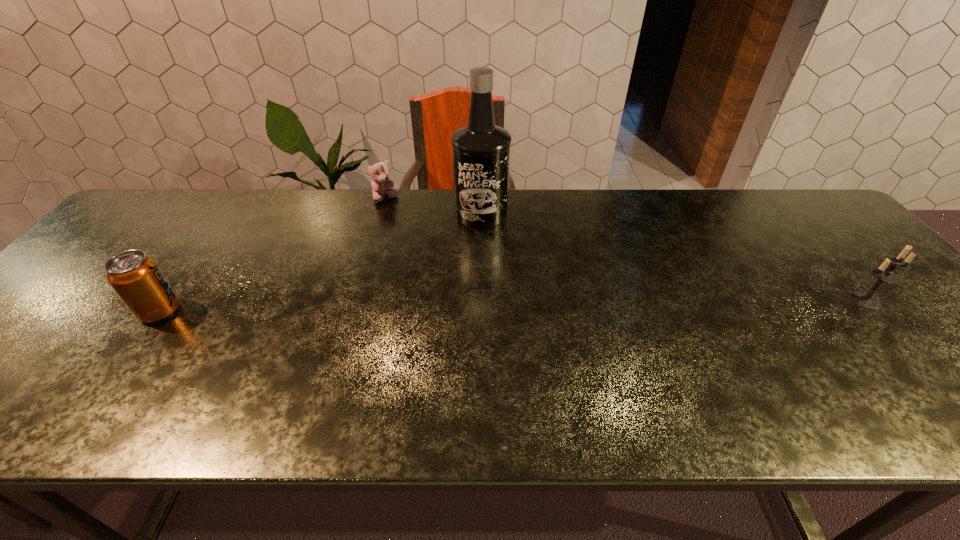
Locate an element on the screen. free area in between the liquor and the teddy bear is located at coordinates (433, 206).

You are a GUI agent. You are given a task and a screenshot of the screen. Output one action in this format:
    pyautogui.click(x=<x>, y=<y>)
    Task: Click on the closest object to the soda can
    
    Given the screenshot: What is the action you would take?
    pyautogui.click(x=382, y=186)

At what (x,y) coordinates should I click in order to perform the action: click on the closest object relative to the third object from left to right. Please return your answer as a coordinate pair (x, y). Looking at the image, I should click on (382, 186).

Where is `vacant area that satisfies the following two spatial constraints: 1. on the back side of the rightmost object; 2. on the right side of the leftmost object`? vacant area that satisfies the following two spatial constraints: 1. on the back side of the rightmost object; 2. on the right side of the leftmost object is located at coordinates (167, 300).